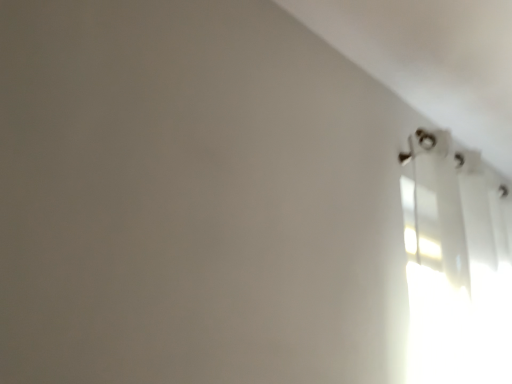
Measure the distance between white glossy blinds at upper right and camera.

4.06 feet.

At what (x,y) coordinates should I click in order to perform the action: click on white glossy blinds at upper right. Please return your answer as a coordinate pair (x, y). The height and width of the screenshot is (384, 512). Looking at the image, I should click on (455, 266).

The height and width of the screenshot is (384, 512). What do you see at coordinates (455, 266) in the screenshot?
I see `white glossy blinds at upper right` at bounding box center [455, 266].

Locate an element on the screen. The height and width of the screenshot is (384, 512). white glossy blinds at upper right is located at coordinates click(x=455, y=266).